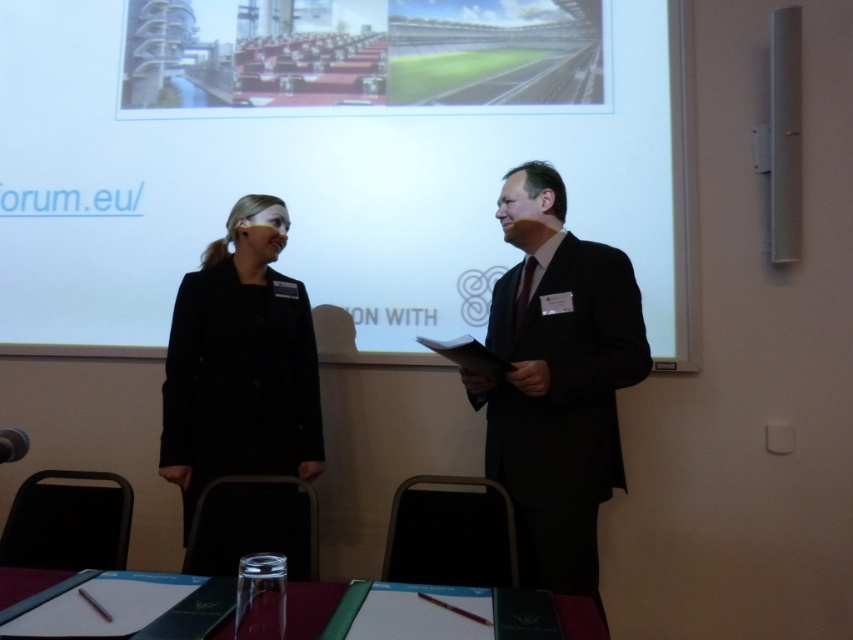
You are an attendee at this event and need to exit the room quickly. You see the white matte projection screen at upper center and the black matte coat at center. Which object is closer to you, and should you avoid bumping into it while leaving?

The white matte projection screen at upper center is closer to you, so you should avoid bumping into it while leaving since it is closer than the black matte coat at center.